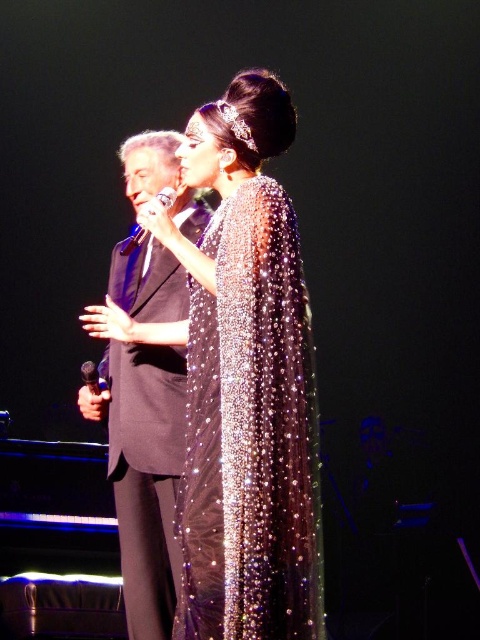
Question: Does black satin suit at center have a larger size compared to metallic silver microphone at upper center?

Choices:
 (A) no
 (B) yes

Answer: (B)

Question: Which point appears closest to the camera in this image?

Choices:
 (A) (168, 193)
 (B) (139, 536)

Answer: (A)

Question: Which point is closer to the camera?

Choices:
 (A) (86, 364)
 (B) (167, 397)
 (C) (168, 195)

Answer: (C)

Question: Is black satin suit at center below metallic silver microphone at center?

Choices:
 (A) no
 (B) yes

Answer: (A)

Question: Among these points, which one is nearest to the camera?

Choices:
 (A) (160, 540)
 (B) (96, 388)
 (C) (122, 244)

Answer: (A)

Question: From the image, what is the correct spatial relationship of black satin suit at center in relation to metallic silver microphone at center?

Choices:
 (A) right
 (B) left

Answer: (A)